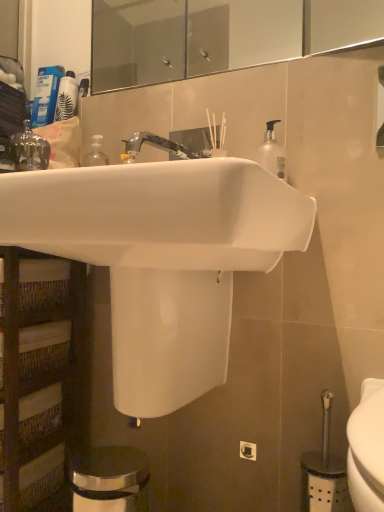
Locate an element on the screen. Image resolution: width=384 pixels, height=512 pixels. compact blue lotion at upper left is located at coordinates (46, 95).

The height and width of the screenshot is (512, 384). What do you see at coordinates (37, 373) in the screenshot? I see `woven wood shelf at left` at bounding box center [37, 373].

What is the approximate height of woven wood shelf at left?

woven wood shelf at left is 25.83 inches tall.

The height and width of the screenshot is (512, 384). Find the location of `gold metallic crown at upper left`. gold metallic crown at upper left is located at coordinates (29, 150).

Is compact blue lotion at upper left to the left of gold metallic crown at upper left from the viewer's perspective?

Yes, compact blue lotion at upper left is to the left of gold metallic crown at upper left.

Is compact blue lotion at upper left with gold metallic crown at upper left?

No, compact blue lotion at upper left is not touching gold metallic crown at upper left.

Find the location of a particular element. The height and width of the screenshot is (512, 384). toiletry on the left of the gold metallic crown at upper left is located at coordinates (46, 95).

Can you confirm if gold metallic crown at upper left is shorter than woven wood shelf at left?

Correct, gold metallic crown at upper left is not as tall as woven wood shelf at left.

From a real-world perspective, is gold metallic crown at upper left located higher than woven wood shelf at left?

Yes, from a real-world perspective, gold metallic crown at upper left is on top of woven wood shelf at left.

Between gold metallic crown at upper left and woven wood shelf at left, which one has larger width?

Wider between the two is woven wood shelf at left.

Is gold metallic crown at upper left with woven wood shelf at left?

gold metallic crown at upper left is not next to woven wood shelf at left, and they're not touching.

Which point is more forward, (18, 149) or (292, 237)?

Point (292, 237)

Based on their positions, is gold metallic crown at upper left located to the left or right of white glossy sink at center?

gold metallic crown at upper left is to the left of white glossy sink at center.

From the image's perspective, does gold metallic crown at upper left appear lower than white glossy sink at center?

No, from the image's perspective, gold metallic crown at upper left is not beneath white glossy sink at center.

Can you confirm if gold metallic crown at upper left is bigger than white glossy sink at center?

No, gold metallic crown at upper left is not bigger than white glossy sink at center.

Can you confirm if woven wood shelf at left is positioned to the left of compact blue lotion at upper left?

Yes, woven wood shelf at left is to the left of compact blue lotion at upper left.

Considering the relative sizes of woven wood shelf at left and compact blue lotion at upper left in the image provided, is woven wood shelf at left thinner than compact blue lotion at upper left?

No.

Which point is more forward, [8,462] or [45,113]?

The point [8,462] is more forward.

Consider the image. Is woven wood shelf at left not within compact blue lotion at upper left?

woven wood shelf at left is positioned outside compact blue lotion at upper left.

Looking at the image, does gold metallic crown at upper left seem bigger or smaller compared to compact blue lotion at upper left?

In the image, gold metallic crown at upper left appears to be smaller than compact blue lotion at upper left.

Is gold metallic crown at upper left positioned beyond the bounds of compact blue lotion at upper left?

Absolutely, gold metallic crown at upper left is external to compact blue lotion at upper left.

Identify the location of plumbing fixture below the compact blue lotion at upper left (from a real-world perspective). This screenshot has height=512, width=384. (29, 150).

Is gold metallic crown at upper left thinner than compact blue lotion at upper left?

Indeed, gold metallic crown at upper left has a lesser width compared to compact blue lotion at upper left.

Between white glossy sink at center and gold metallic crown at upper left, which one has larger width?

With larger width is white glossy sink at center.

Is white glossy sink at center oriented away from gold metallic crown at upper left?

No, white glossy sink at center is not facing away from gold metallic crown at upper left.

At what (x,y) coordinates should I click in order to perform the action: click on sink that appears on the right of gold metallic crown at upper left. Please return your answer as a coordinate pair (x, y). This screenshot has width=384, height=512. Looking at the image, I should click on [162, 258].

Is compact blue lotion at upper left looking in the opposite direction of white glossy sink at center?

No, compact blue lotion at upper left is not facing the opposite direction of white glossy sink at center.

Choose the correct answer: Is compact blue lotion at upper left inside white glossy sink at center or outside it?

The correct answer is: outside.

What's the angular difference between compact blue lotion at upper left and white glossy sink at center's facing directions?

compact blue lotion at upper left and white glossy sink at center are facing 0.00283 degrees away from each other.

From a real-world perspective, is compact blue lotion at upper left below white glossy sink at center?

No, from a real-world perspective, compact blue lotion at upper left is not under white glossy sink at center.

I want to click on toiletry located on the left of gold metallic crown at upper left, so click(x=46, y=95).

You are a GUI agent. You are given a task and a screenshot of the screen. Output one action in this format:
    pyautogui.click(x=<x>, y=<y>)
    Task: Click on the shelf in front of the gold metallic crown at upper left
    The height and width of the screenshot is (512, 384).
    Given the screenshot: What is the action you would take?
    pyautogui.click(x=37, y=373)

Based on their spatial positions, is gold metallic crown at upper left or woven wood shelf at left further from compact blue lotion at upper left?

Among the two, woven wood shelf at left is located further to compact blue lotion at upper left.

Looking at the image, which one is located further to white glossy sink at center, woven wood shelf at left or gold metallic crown at upper left?

gold metallic crown at upper left is positioned further to the anchor white glossy sink at center.

Looking at the image, which one is located further to white glossy sink at center, gold metallic crown at upper left or compact blue lotion at upper left?

The object further to white glossy sink at center is compact blue lotion at upper left.

Based on their spatial positions, is woven wood shelf at left or white glossy sink at center further from gold metallic crown at upper left?

Among the two, white glossy sink at center is located further to gold metallic crown at upper left.

Looking at the image, which one is located closer to compact blue lotion at upper left, woven wood shelf at left or white glossy sink at center?

woven wood shelf at left.

Which object lies further to the anchor point woven wood shelf at left, compact blue lotion at upper left or gold metallic crown at upper left?

The object further to woven wood shelf at left is compact blue lotion at upper left.

Estimate the real-world distances between objects in this image. Which object is closer to woven wood shelf at left, compact blue lotion at upper left or white glossy sink at center?

white glossy sink at center lies closer to woven wood shelf at left than the other object.

When comparing their distances from woven wood shelf at left, does white glossy sink at center or compact blue lotion at upper left seem closer?

white glossy sink at center is closer to woven wood shelf at left.

The height and width of the screenshot is (512, 384). I want to click on plumbing fixture between white glossy sink at center and compact blue lotion at upper left in the front-back direction, so click(29, 150).

Image resolution: width=384 pixels, height=512 pixels. What are the coordinates of `plumbing fixture between compact blue lotion at upper left and woven wood shelf at left from top to bottom` in the screenshot? It's located at (29, 150).

Locate an element on the screen. Image resolution: width=384 pixels, height=512 pixels. sink between gold metallic crown at upper left and woven wood shelf at left in the up-down direction is located at coordinates (162, 258).

Where is `sink between compact blue lotion at upper left and woven wood shelf at left vertically`? sink between compact blue lotion at upper left and woven wood shelf at left vertically is located at coordinates (162, 258).